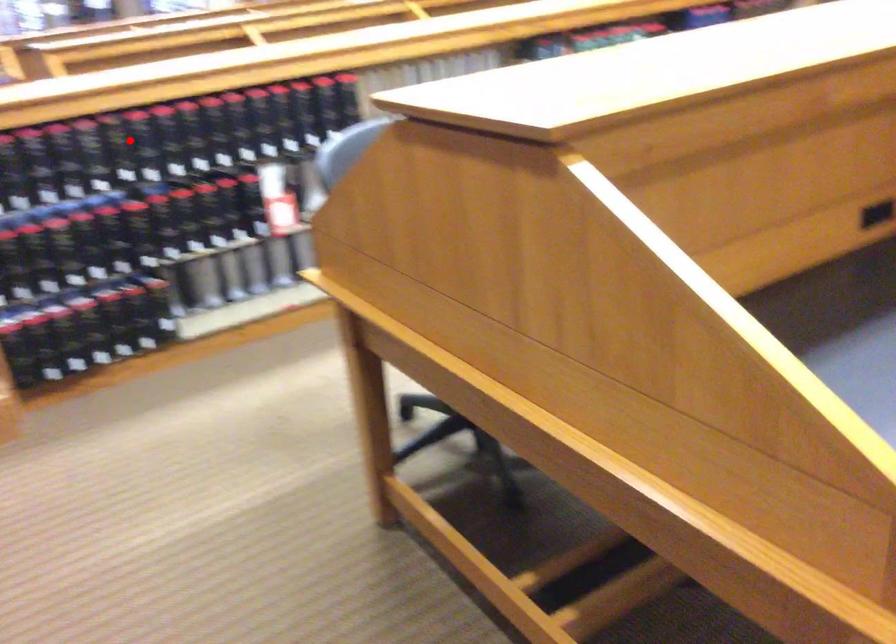
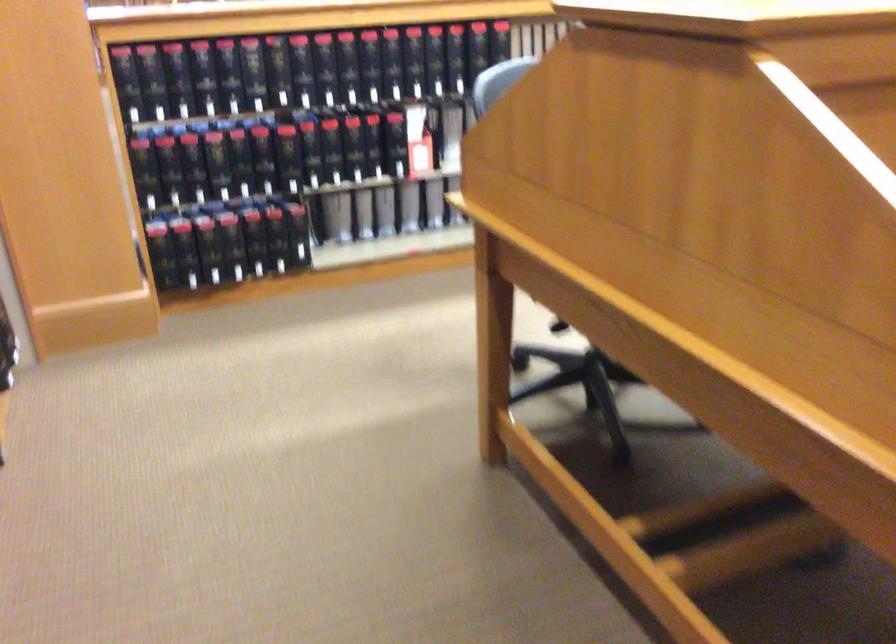
Where in the second image is the point corresponding to the highlighted location from the first image?

(291, 71)